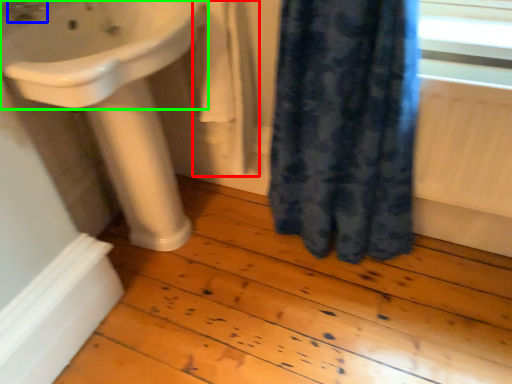
Question: Considering the real-world distances, which object is closest to bath towel (highlighted by a red box)? tap (highlighted by a blue box) or sink (highlighted by a green box).

Choices:
 (A) tap
 (B) sink

Answer: (B)